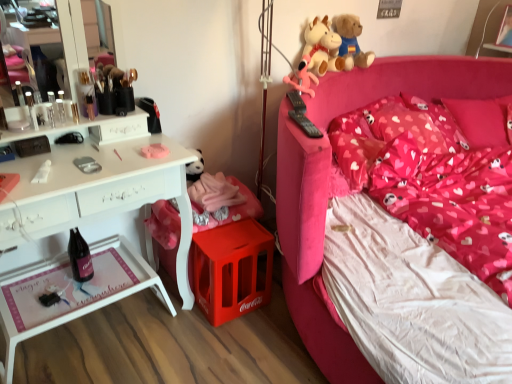
At what (x,y) coordinates should I click in order to perform the action: click on vacant space to the left of black glass bottle at lower left. Please return your answer as a coordinate pair (x, y). This screenshot has width=512, height=384. Looking at the image, I should click on (64, 274).